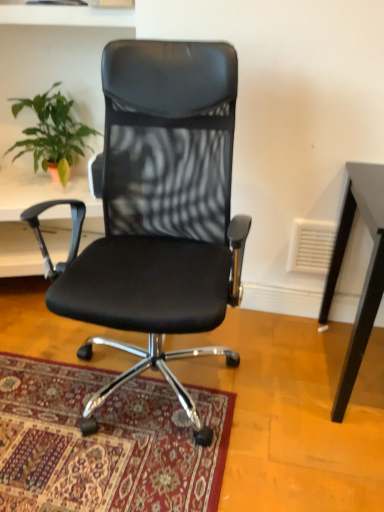
Question: From the image's perspective, is black leather office chair at center located above or below green leafy plant at upper left?

Choices:
 (A) below
 (B) above

Answer: (A)

Question: Is point (211, 48) positioned closer to the camera than point (31, 99)?

Choices:
 (A) closer
 (B) farther

Answer: (A)

Question: Which object is positioned closest to the black leather office chair at center?

Choices:
 (A) carpeted rug at center
 (B) green leafy plant at upper left

Answer: (A)

Question: Which object is the closest to the green leafy plant at upper left?

Choices:
 (A) carpeted rug at center
 (B) black leather office chair at center

Answer: (B)